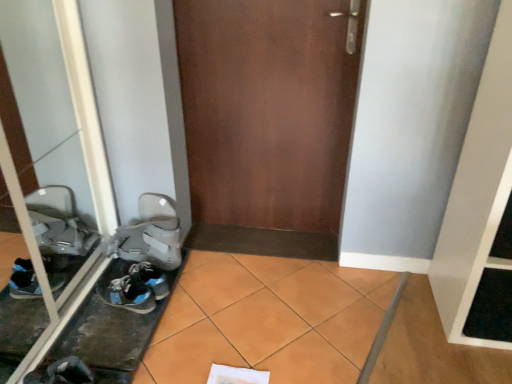
The image size is (512, 384). What are the coordinates of `free space in front of blue synthetic sneakers at lower left, the 2th footwear in the back-to-front sequence` in the screenshot? It's located at (113, 333).